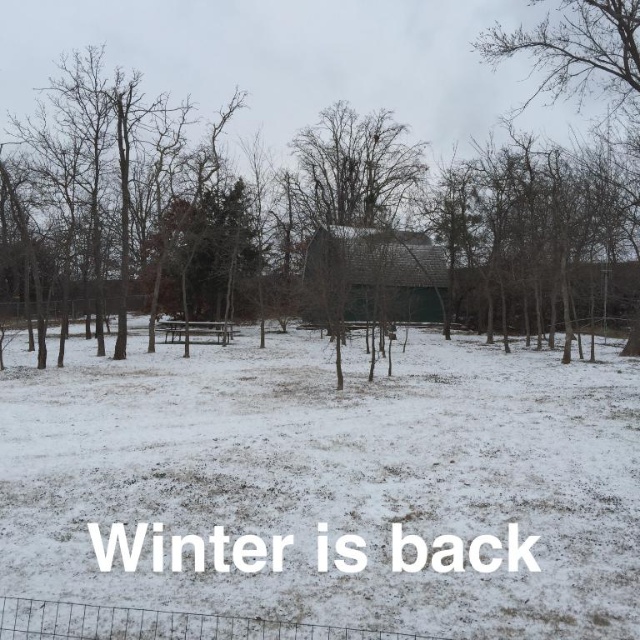
You are standing in the snowy field and want to take a photo of the dark gray shingles barn at center and the bare branches at upper right. Which object will appear larger in your photo?

The dark gray shingles barn at center will appear larger in the photo because it is closer to the viewer than the bare branches at upper right.

You are a photographer setting up a shot of the dark gray shingles barn at center and the bare branches at upper right. If you want to frame both subjects so that the barn is on the left side of the photo and the branches are on the right side, will their current positions allow this?

Yes, because the dark gray shingles barn at center is already positioned to the left of the bare branches at upper right, so framing them with the barn on the left and branches on the right is possible.